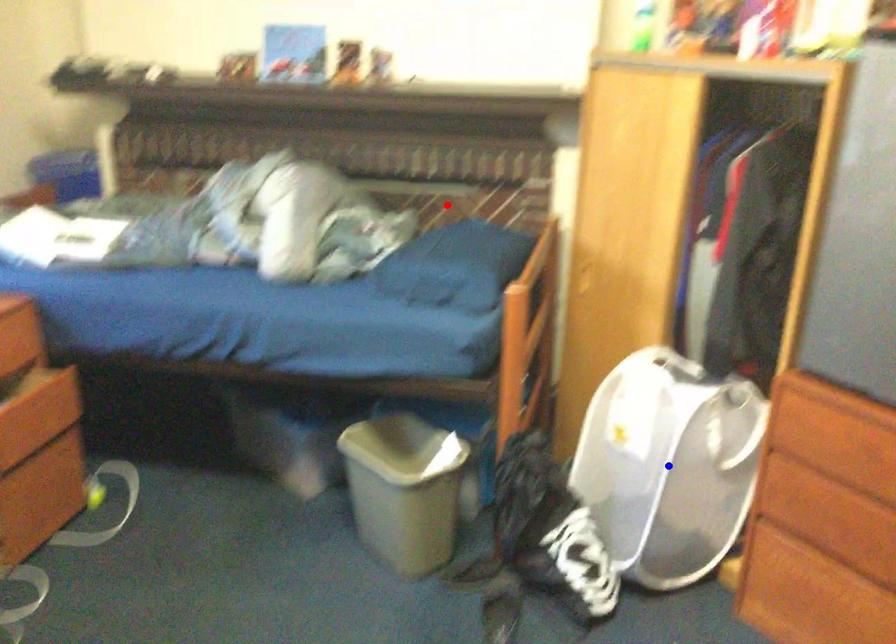
Question: In the image, two points are highlighted. Which point is nearer to the camera? Reply with the corresponding letter.

Choices:
 (A) blue point
 (B) red point

Answer: (A)